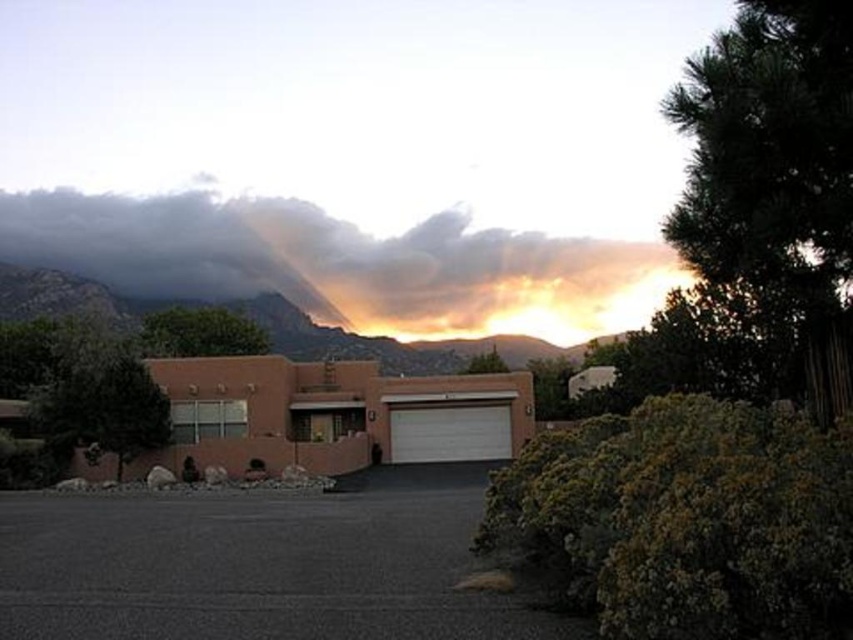
You are standing at the edge of the rugged stone mountain at upper center and want to walk to the dark asphalt driveway at center. In which direction should you head?

You should head to the left because the dark asphalt driveway at center is to the right of rugged stone mountain at upper center, so from the mountain, the driveway is to your right, meaning you need to move left to reach it.

In the scene shown: You are standing at the entrance of the house and want to walk to the rugged stone mountain at upper center. Which direction should you go relative to the dark asphalt driveway at center?

The rugged stone mountain at upper center is behind the dark asphalt driveway at center, so you should walk away from the driveway towards the mountain.